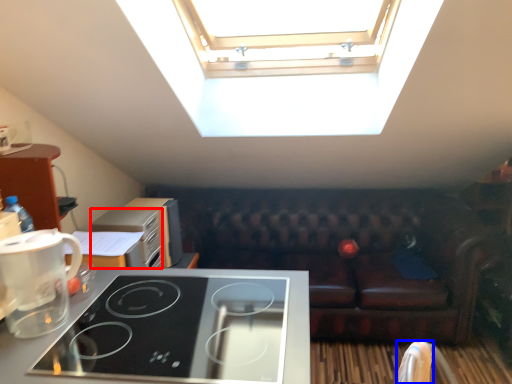
Question: Which object appears closest to the camera in this image, appliance (highlighted by a red box) or armchair (highlighted by a blue box)?

Choices:
 (A) appliance
 (B) armchair

Answer: (B)